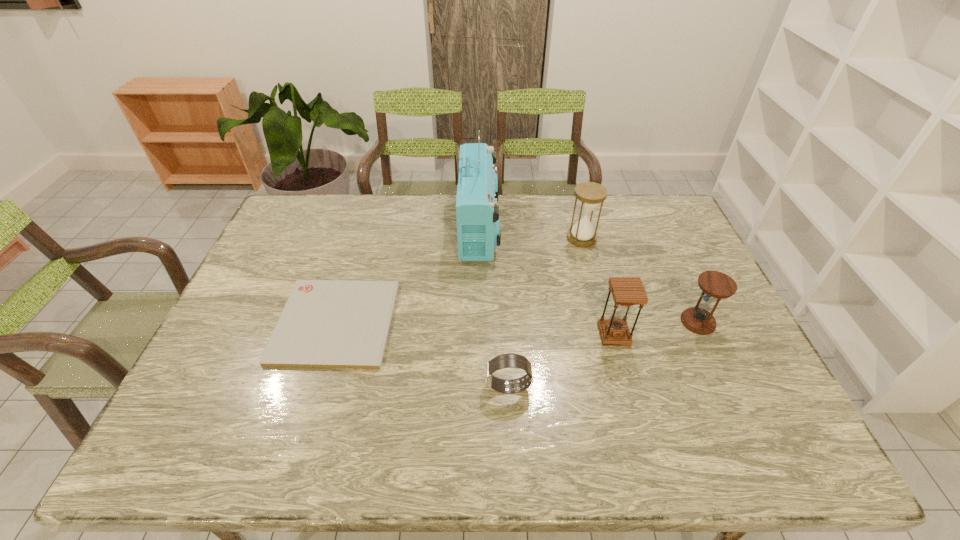
At what (x,y) coordinates should I click in order to perform the action: click on radio receiver. Please return your answer as a coordinate pair (x, y). This screenshot has height=540, width=960. Looking at the image, I should click on (478, 219).

Where is `the farthest hourglass`? This screenshot has width=960, height=540. the farthest hourglass is located at coordinates (589, 194).

At what (x,y) coordinates should I click in order to perform the action: click on the rightmost object. Please return your answer as a coordinate pair (x, y). The height and width of the screenshot is (540, 960). Looking at the image, I should click on (715, 285).

The image size is (960, 540). I want to click on the fourth tallest object, so click(x=715, y=285).

Identify the location of the second shortest object. point(510,360).

I want to click on the nearest object, so click(510, 360).

You are a GUI agent. You are given a task and a screenshot of the screen. Output one action in this format:
    pyautogui.click(x=<x>, y=<y>)
    Task: Click on the clipboard
    This screenshot has height=540, width=960.
    Given the screenshot: What is the action you would take?
    pyautogui.click(x=325, y=323)

Locate an element on the screen. This screenshot has height=540, width=960. the shortest object is located at coordinates (325, 323).

Find the location of `free point located on the front-facing side of the tallest object`. free point located on the front-facing side of the tallest object is located at coordinates (521, 228).

Find the location of a particular element. vacant space located 0.290m on the left of the farthest hourglass is located at coordinates (481, 238).